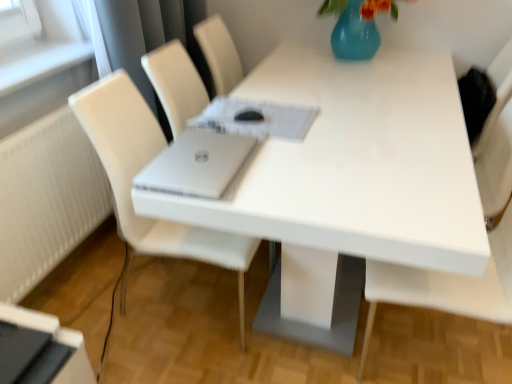
Image resolution: width=512 pixels, height=384 pixels. In order to click on free space in front of white leather chair at center, the second chair positioned from the right in this screenshot , I will do `click(190, 360)`.